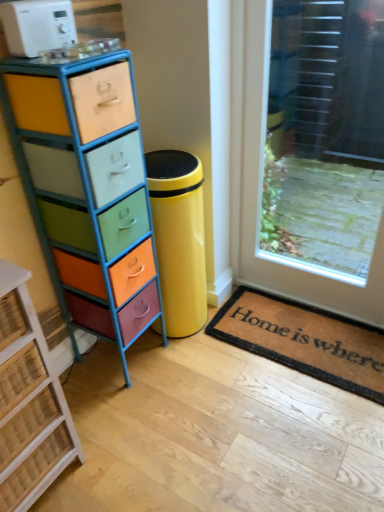
Image resolution: width=384 pixels, height=512 pixels. I want to click on vacant area that is in front of brown coir mat at lower right, so click(x=289, y=434).